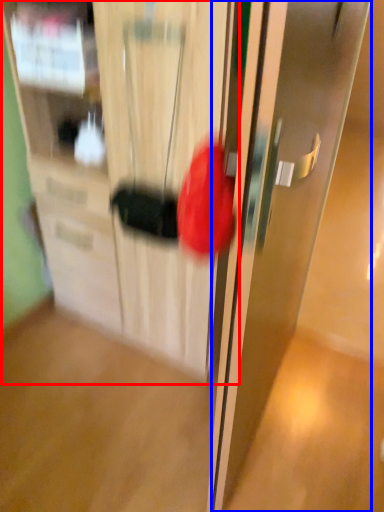
Question: Among these objects, which one is nearest to the camera, cabinetry (highlighted by a red box) or door (highlighted by a blue box)?

Choices:
 (A) cabinetry
 (B) door

Answer: (B)